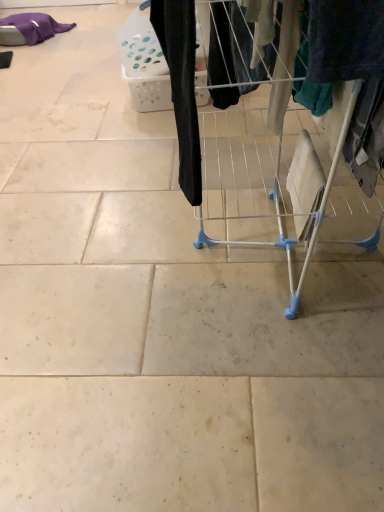
Image resolution: width=384 pixels, height=512 pixels. I want to click on vacant space to the left of white wire drying rack at center, so click(114, 267).